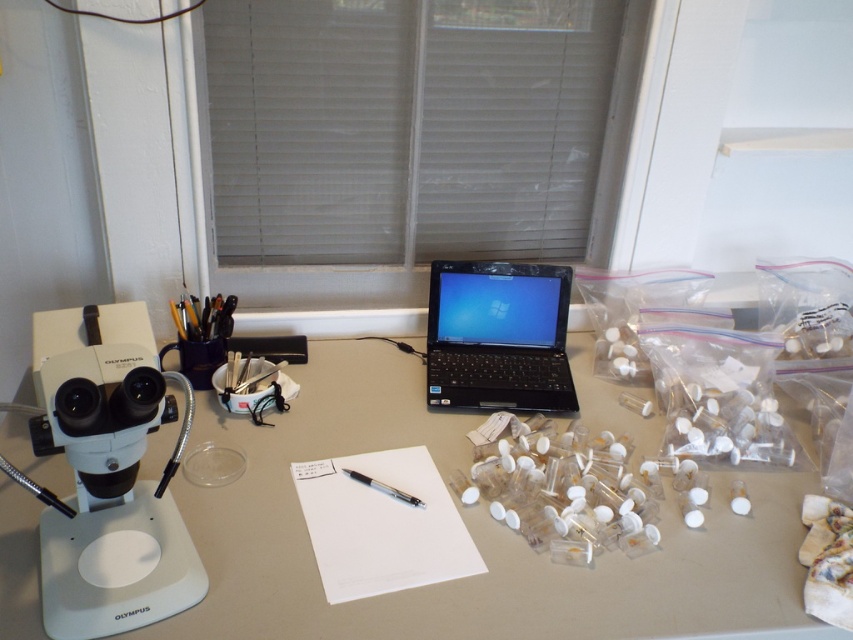
Is white plastic microscope at left thinner than black plastic laptop at center?

In fact, white plastic microscope at left might be wider than black plastic laptop at center.

Between white plastic microscope at left and black plastic laptop at center, which one is positioned higher?

black plastic laptop at center is higher up.

Is point (91, 340) farther from viewer compared to point (454, 332)?

No, (91, 340) is in front of (454, 332).

Find the location of a particular element. The image size is (853, 640). white plastic microscope at left is located at coordinates (109, 474).

Does white matte blinds at upper center lie behind black plastic laptop at center?

No, white matte blinds at upper center is in front of black plastic laptop at center.

Consider the image. Does white matte blinds at upper center have a larger size compared to black plastic laptop at center?

Indeed, white matte blinds at upper center has a larger size compared to black plastic laptop at center.

Where is `white matte blinds at upper center`? The height and width of the screenshot is (640, 853). white matte blinds at upper center is located at coordinates (405, 125).

Identify the location of white matte blinds at upper center. (405, 125).

Is the position of white paper at center less distant than that of black metallic pen at center?

Yes, it is.

Who is shorter, white paper at center or black metallic pen at center?

black metallic pen at center is shorter.

The width and height of the screenshot is (853, 640). I want to click on white paper at center, so click(381, 524).

The image size is (853, 640). In order to click on white paper at center in this screenshot , I will do `click(381, 524)`.